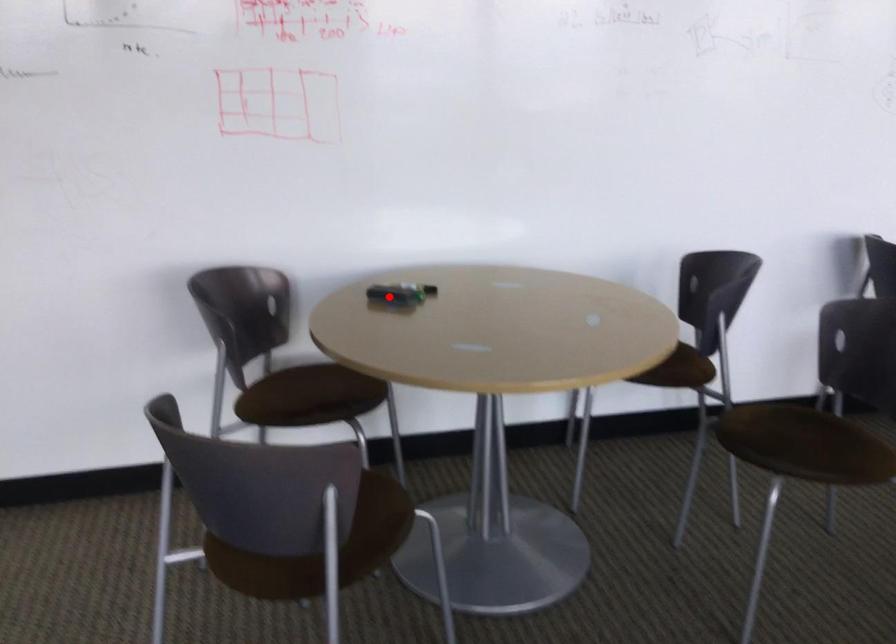
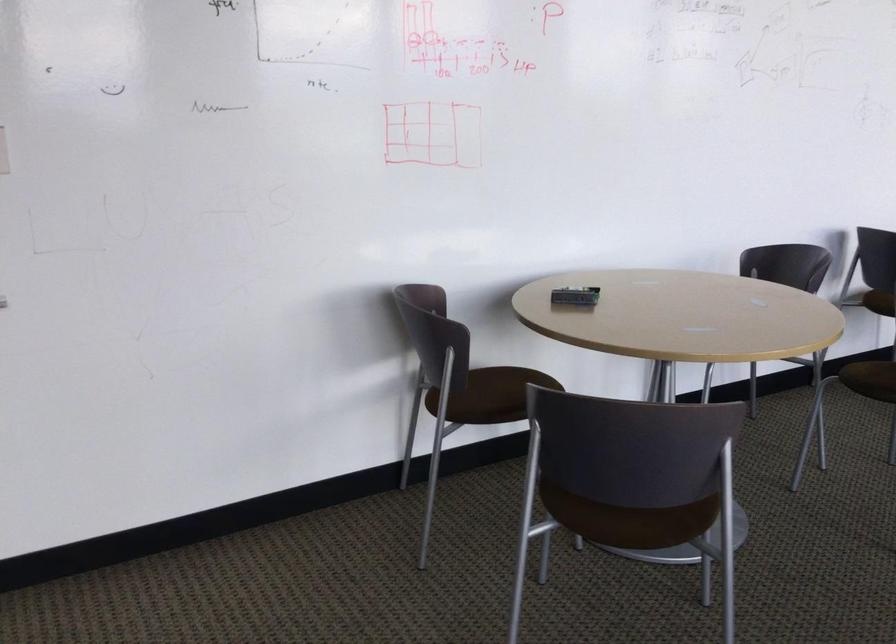
Find the pixel in the second image that matches the highlighted location in the first image.

(575, 296)